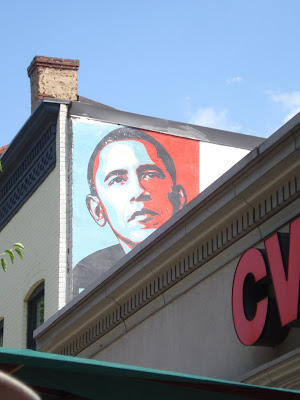
Locate an element on the screen. color red in mural is located at coordinates point(185,151).